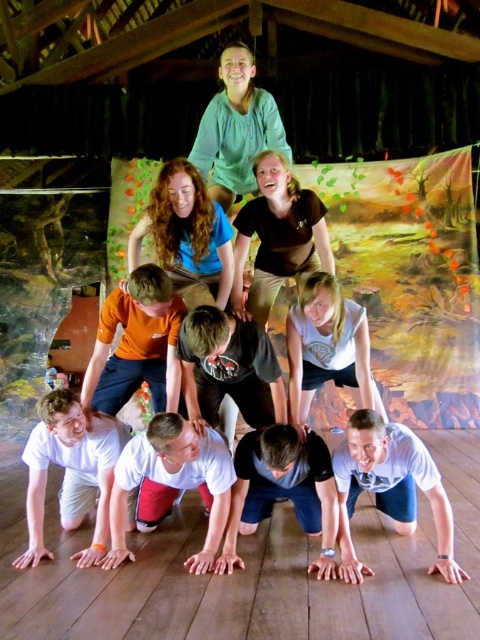
Based on the photo, can you confirm if white matte shirt at lower center is positioned above white cotton shirt at lower right?

No, white matte shirt at lower center is not above white cotton shirt at lower right.

Which is behind, point (149, 499) or point (388, 442)?

The point (149, 499) is more distant.

What do you see at coordinates (170, 483) in the screenshot? I see `white matte shirt at lower center` at bounding box center [170, 483].

What are the coordinates of `white matte shirt at lower center` in the screenshot? It's located at (170, 483).

Is white matte t-shirt at lower center below white matte shirt at lower center?

Actually, white matte t-shirt at lower center is above white matte shirt at lower center.

Who is more forward, (39, 467) or (194, 557)?

Point (194, 557)

At what (x,y) coordinates should I click in order to perform the action: click on white matte t-shirt at lower center. Please return your answer as a coordinate pair (x, y). Looking at the image, I should click on (71, 472).

Measure the distance between point (x=36, y=531) and camera.

They are 8.84 feet apart.

Measure the distance from white matte t-shirt at lower center to dark blue jeans at center.

The distance of white matte t-shirt at lower center from dark blue jeans at center is 84.63 centimeters.

Locate an element on the screen. white matte t-shirt at lower center is located at coordinates (71, 472).